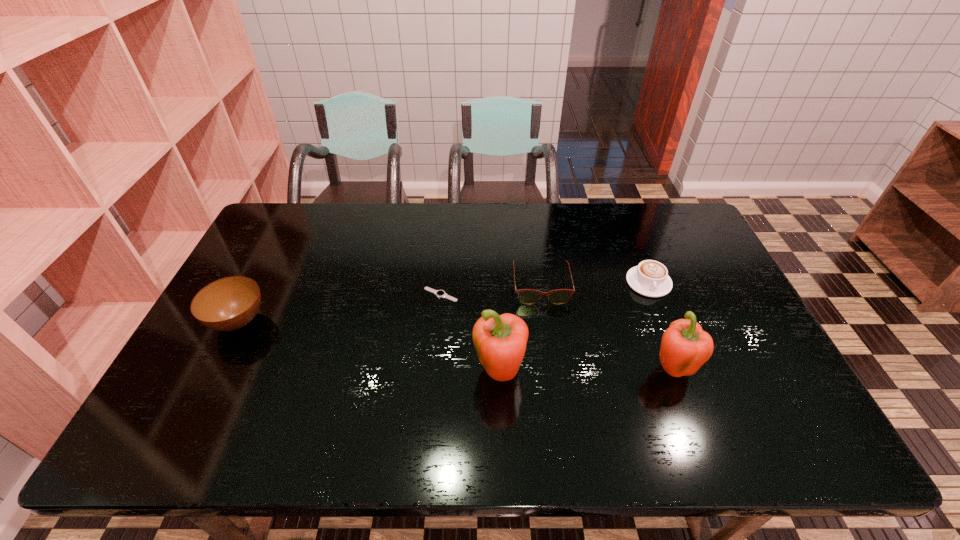
I want to click on the second closest object to the cappuccino, so click(x=685, y=347).

The height and width of the screenshot is (540, 960). Identify the location of object that ranks as the fourth closest to the shorter pepper. (439, 293).

Where is `vacant point that satisfies the following two spatial constraints: 1. at the front view of the shorter pepper; 2. on the right side of the spectacles`? The width and height of the screenshot is (960, 540). vacant point that satisfies the following two spatial constraints: 1. at the front view of the shorter pepper; 2. on the right side of the spectacles is located at coordinates (552, 369).

This screenshot has width=960, height=540. Find the location of `vacant space that satisfies the following two spatial constraints: 1. at the front view of the shorter pepper; 2. on the right side of the spectacles`. vacant space that satisfies the following two spatial constraints: 1. at the front view of the shorter pepper; 2. on the right side of the spectacles is located at coordinates (552, 369).